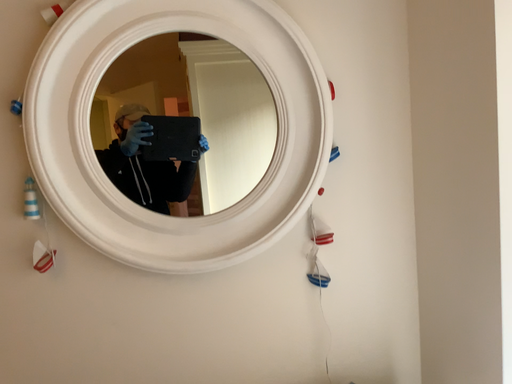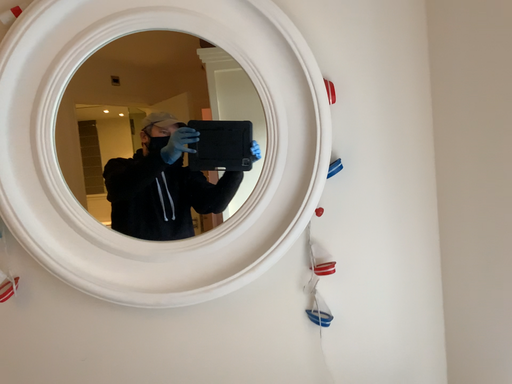
Question: Which way did the camera rotate in the video?

Choices:
 (A) rotated left
 (B) rotated right

Answer: (A)